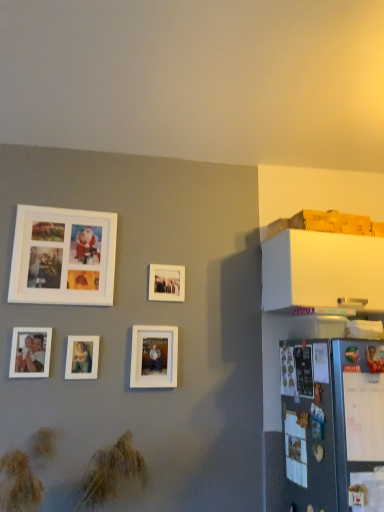
Question: From the image's perspective, is matte white picture frame at center, the third picture frame from the left, under white matte picture frame at center, which is counted as the 1th picture frame, starting from the right?

Choices:
 (A) no
 (B) yes

Answer: (B)

Question: From a real-world perspective, is matte white picture frame at center, marked as the third picture frame in a right-to-left arrangement, on top of white matte picture frame at center, acting as the 5th picture frame starting from the left?

Choices:
 (A) yes
 (B) no

Answer: (B)

Question: Is matte white picture frame at center, marked as the third picture frame in a right-to-left arrangement, behind white matte picture frame at center, acting as the 5th picture frame starting from the left?

Choices:
 (A) no
 (B) yes

Answer: (A)

Question: Is matte white picture frame at center, the third picture frame from the left, located outside white matte picture frame at center, which is counted as the 1th picture frame, starting from the right?

Choices:
 (A) yes
 (B) no

Answer: (A)

Question: Considering the relative sizes of matte white picture frame at center, marked as the third picture frame in a right-to-left arrangement, and white matte picture frame at center, which is counted as the 1th picture frame, starting from the right, in the image provided, is matte white picture frame at center, marked as the third picture frame in a right-to-left arrangement, bigger than white matte picture frame at center, which is counted as the 1th picture frame, starting from the right,?

Choices:
 (A) no
 (B) yes

Answer: (A)

Question: Can you confirm if matte white picture frame at center, marked as the third picture frame in a right-to-left arrangement, is wider than white matte picture frame at center, acting as the 5th picture frame starting from the left?

Choices:
 (A) yes
 (B) no

Answer: (B)

Question: From a real-world perspective, is matte white photo frame at lower left, the fifth picture frame from the right, physically above white matte picture frame at center, which is counted as the 1th picture frame, starting from the right?

Choices:
 (A) no
 (B) yes

Answer: (A)

Question: Is matte white photo frame at lower left, the fifth picture frame from the right, positioned before white matte picture frame at center, acting as the 5th picture frame starting from the left?

Choices:
 (A) no
 (B) yes

Answer: (B)

Question: Is matte white photo frame at lower left, the fifth picture frame from the right, behind white matte picture frame at center, acting as the 5th picture frame starting from the left?

Choices:
 (A) yes
 (B) no

Answer: (B)

Question: Is matte white photo frame at lower left, the 1th picture frame viewed from the left, wider than white matte picture frame at center, which is counted as the 1th picture frame, starting from the right?

Choices:
 (A) yes
 (B) no

Answer: (A)

Question: Can you confirm if matte white photo frame at lower left, the fifth picture frame from the right, is smaller than white matte picture frame at center, acting as the 5th picture frame starting from the left?

Choices:
 (A) no
 (B) yes

Answer: (A)

Question: From the image's perspective, is matte white photo frame at lower left, the 1th picture frame viewed from the left, above white matte picture frame at center, which is counted as the 1th picture frame, starting from the right?

Choices:
 (A) yes
 (B) no

Answer: (B)

Question: Is white matte picture frame at upper left, which appears as the second picture frame when viewed from the left, to the left of matte white picture frame at center, marked as the third picture frame in a right-to-left arrangement, from the viewer's perspective?

Choices:
 (A) no
 (B) yes

Answer: (B)